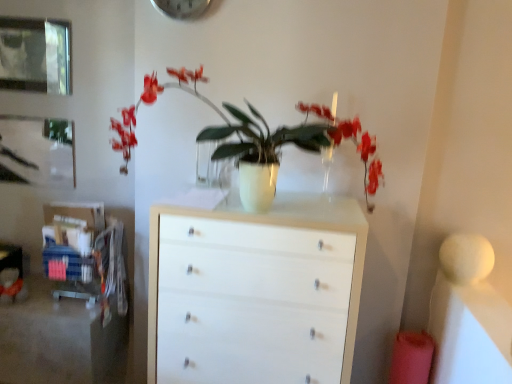
Question: From the image's perspective, is white glossy chest of drawers at center below brushed metal picture frame at upper left, which ranks as the first picture frame in back-to-front order?

Choices:
 (A) yes
 (B) no

Answer: (A)

Question: Can you confirm if white glossy chest of drawers at center is positioned to the right of brushed metal picture frame at upper left, which is the 2th picture frame from front to back?

Choices:
 (A) no
 (B) yes

Answer: (B)

Question: Does white glossy chest of drawers at center have a lesser width compared to brushed metal picture frame at upper left, which appears as the 2th picture frame when viewed from the top?

Choices:
 (A) no
 (B) yes

Answer: (A)

Question: Is white glossy chest of drawers at center not inside brushed metal picture frame at upper left, which appears as the 2th picture frame when viewed from the top?

Choices:
 (A) yes
 (B) no

Answer: (A)

Question: Considering the relative sizes of white glossy chest of drawers at center and brushed metal picture frame at upper left, which ranks as the 1th picture frame in bottom-to-top order, in the image provided, is white glossy chest of drawers at center bigger than brushed metal picture frame at upper left, which ranks as the 1th picture frame in bottom-to-top order,?

Choices:
 (A) no
 (B) yes

Answer: (B)

Question: Is white glossy chest of drawers at center facing away from brushed metal picture frame at upper left, which appears as the 2th picture frame when viewed from the top?

Choices:
 (A) yes
 (B) no

Answer: (B)

Question: Does brushed metal picture frame at upper left, which ranks as the 1th picture frame in bottom-to-top order, turn towards white glossy vase at center?

Choices:
 (A) yes
 (B) no

Answer: (B)

Question: Is brushed metal picture frame at upper left, which is the 2th picture frame from front to back, positioned behind white glossy vase at center?

Choices:
 (A) yes
 (B) no

Answer: (A)

Question: Can you confirm if brushed metal picture frame at upper left, which appears as the 2th picture frame when viewed from the top, is shorter than white glossy vase at center?

Choices:
 (A) no
 (B) yes

Answer: (B)

Question: Is brushed metal picture frame at upper left, which appears as the 2th picture frame when viewed from the top, thinner than white glossy vase at center?

Choices:
 (A) no
 (B) yes

Answer: (B)

Question: Is brushed metal picture frame at upper left, which ranks as the 1th picture frame in bottom-to-top order, positioned with its back to white glossy vase at center?

Choices:
 (A) no
 (B) yes

Answer: (A)

Question: Can you confirm if brushed metal picture frame at upper left, which is the 2th picture frame from front to back, is bigger than white glossy vase at center?

Choices:
 (A) yes
 (B) no

Answer: (B)

Question: Are white glossy chest of drawers at center and metallic glass picture frame at upper left, the 2th picture frame from the bottom, making contact?

Choices:
 (A) no
 (B) yes

Answer: (A)